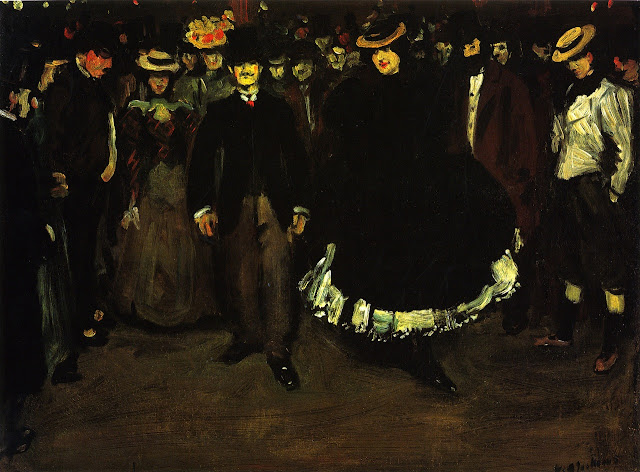
The image size is (640, 472). I want to click on artwork, so click(310, 245).